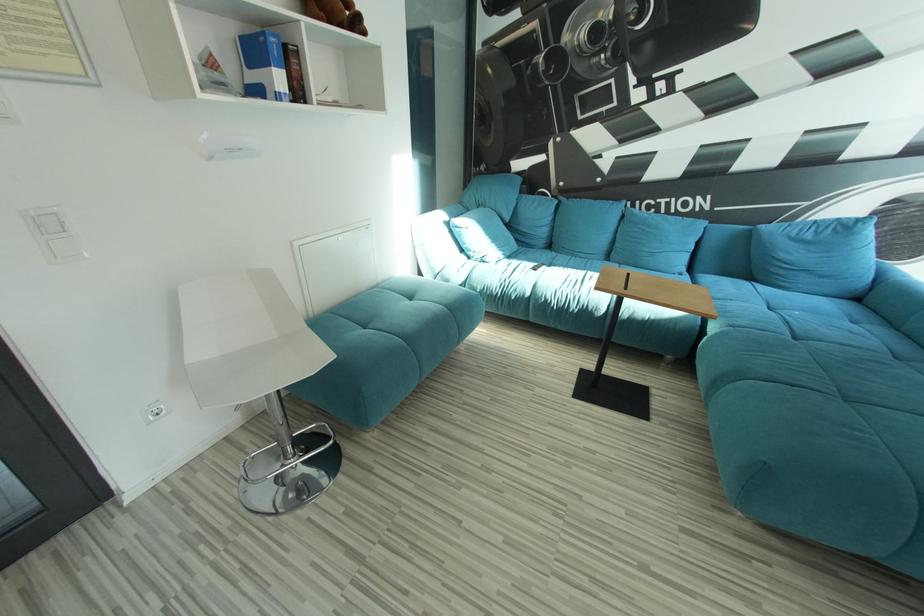
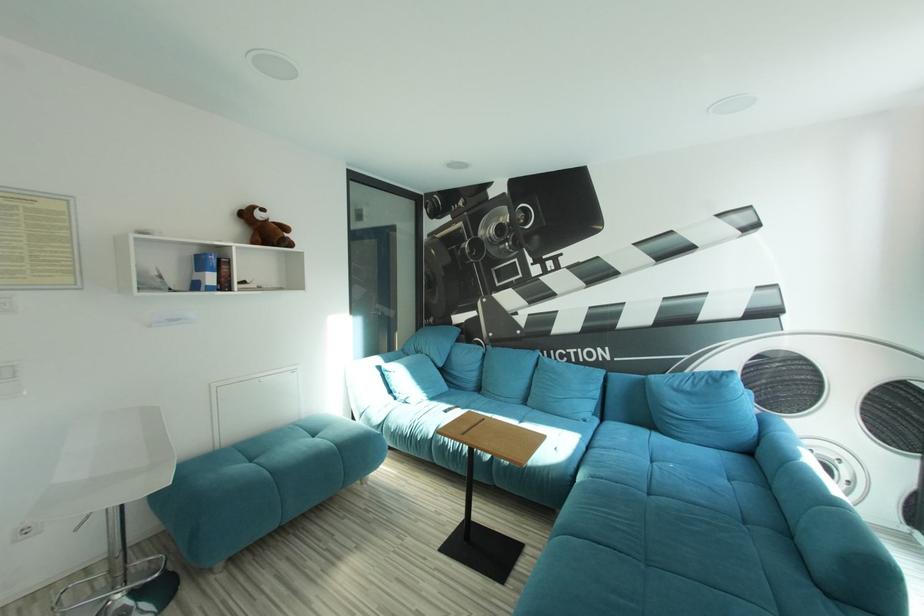
Question: The images are taken continuously from a first-person perspective. In which direction is your viewpoint rotating?

Choices:
 (A) Left
 (B) Right
 (C) Up
 (D) Down

Answer: (C)